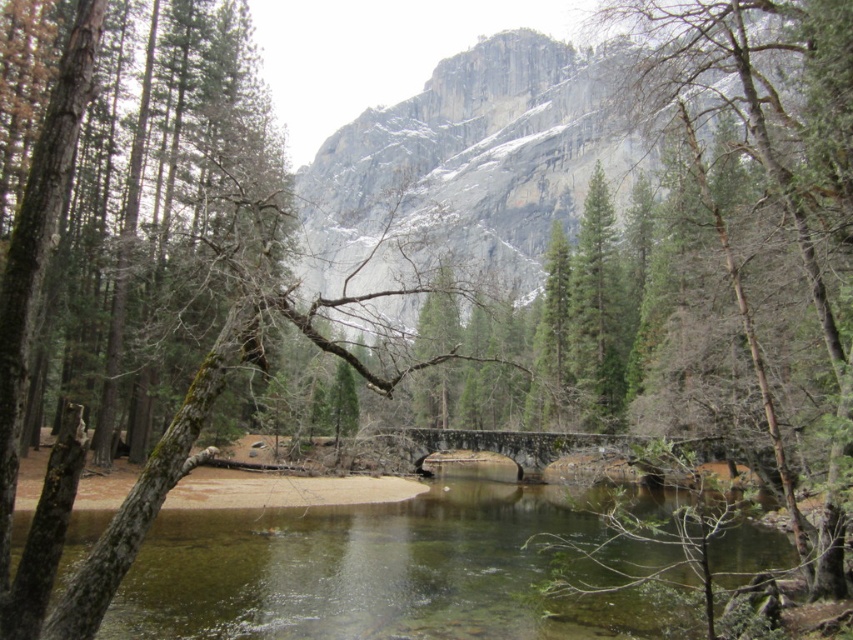
How much distance is there between clear water at center and green matte tree at center?

They are 34.72 meters apart.

Locate an element on the screen. Image resolution: width=853 pixels, height=640 pixels. clear water at center is located at coordinates (376, 570).

Identify the location of clear water at center. The height and width of the screenshot is (640, 853). (376, 570).

Does gray rock mountain at upper center have a lesser height compared to green matte tree at center?

No.

Does gray rock mountain at upper center have a smaller size compared to green matte tree at center?

No, gray rock mountain at upper center is not smaller than green matte tree at center.

Between point (511, 284) and point (616, 404), which one is positioned in front?

Point (616, 404) is in front.

Image resolution: width=853 pixels, height=640 pixels. What are the coordinates of `gray rock mountain at upper center` in the screenshot? It's located at (468, 164).

Who is shorter, clear water at center or stone bridge at center?

clear water at center is shorter.

Can you confirm if clear water at center is wider than stone bridge at center?

Indeed, clear water at center has a greater width compared to stone bridge at center.

The image size is (853, 640). Describe the element at coordinates (376, 570) in the screenshot. I see `clear water at center` at that location.

The height and width of the screenshot is (640, 853). I want to click on clear water at center, so click(376, 570).